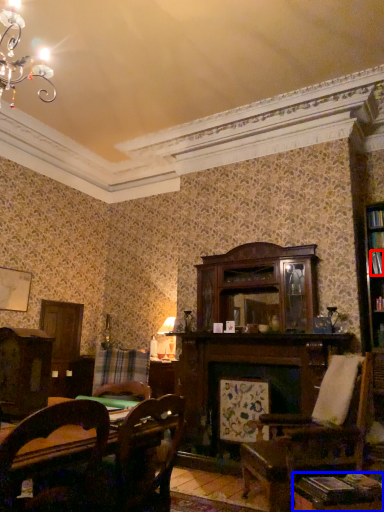
Question: Which of the following is the farthest to the observer, book (highlighted by a red box) or table (highlighted by a blue box)?

Choices:
 (A) book
 (B) table

Answer: (A)